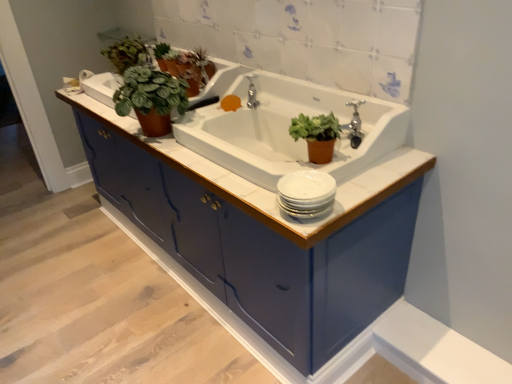
Question: Does white glossy sink at center contain green matte plant at upper left, placed as the 1th houseplant when sorted from back to front?

Choices:
 (A) no
 (B) yes

Answer: (A)

Question: Considering the relative sizes of white glossy sink at center and green matte plant at upper left, the first houseplant in the top-to-bottom sequence, in the image provided, is white glossy sink at center smaller than green matte plant at upper left, the first houseplant in the top-to-bottom sequence,?

Choices:
 (A) yes
 (B) no

Answer: (B)

Question: Are white glossy sink at center and green matte plant at upper left, placed as the 1th houseplant when sorted from back to front, far apart?

Choices:
 (A) no
 (B) yes

Answer: (A)

Question: Does white glossy sink at center appear on the right side of green matte plant at upper left, which is counted as the 3th houseplant, starting from the front?

Choices:
 (A) no
 (B) yes

Answer: (B)

Question: From a real-world perspective, is white glossy sink at center physically above green matte plant at upper left, the third houseplant positioned from the bottom?

Choices:
 (A) no
 (B) yes

Answer: (A)

Question: Choose the correct answer: Is white glossy sink at center inside green matte plant at upper left, acting as the 3th houseplant starting from the right, or outside it?

Choices:
 (A) inside
 (B) outside

Answer: (B)

Question: Is point (183, 115) closer or farther from the camera than point (134, 56)?

Choices:
 (A) farther
 (B) closer

Answer: (B)

Question: Considering their positions, is white glossy sink at center located in front of or behind green matte plant at upper left, placed as the 1th houseplant when sorted from back to front?

Choices:
 (A) behind
 (B) front

Answer: (B)

Question: From the image's perspective, is white glossy sink at center positioned above or below green matte plant at upper left, the first houseplant in the top-to-bottom sequence?

Choices:
 (A) above
 (B) below

Answer: (B)

Question: Considering the positions of white glossy sink at center and green matte plant at upper left, the 2th houseplant positioned from the front, in the image, is white glossy sink at center taller or shorter than green matte plant at upper left, the 2th houseplant positioned from the front,?

Choices:
 (A) short
 (B) tall

Answer: (B)

Question: Considering the positions of white glossy sink at center and green matte plant at upper left, which ranks as the second houseplant in left-to-right order, in the image, is white glossy sink at center bigger or smaller than green matte plant at upper left, which ranks as the second houseplant in left-to-right order,?

Choices:
 (A) big
 (B) small

Answer: (A)

Question: From a real-world perspective, is white glossy sink at center physically located above or below green matte plant at upper left, which appears as the 2th houseplant when viewed from the top?

Choices:
 (A) above
 (B) below

Answer: (B)

Question: Considering the relative positions of white glossy sink at center and green matte plant at upper left, which ranks as the second houseplant in left-to-right order, in the image provided, is white glossy sink at center to the left or to the right of green matte plant at upper left, which ranks as the second houseplant in left-to-right order,?

Choices:
 (A) right
 (B) left

Answer: (A)

Question: Which is correct: green matte plant at upper center is inside matte brown pot at center, which is counted as the 3th houseplant, starting from the top, or outside of it?

Choices:
 (A) inside
 (B) outside

Answer: (B)

Question: Relative to matte brown pot at center, which is counted as the 3th houseplant, starting from the top, is green matte plant at upper center in front or behind?

Choices:
 (A) front
 (B) behind

Answer: (B)